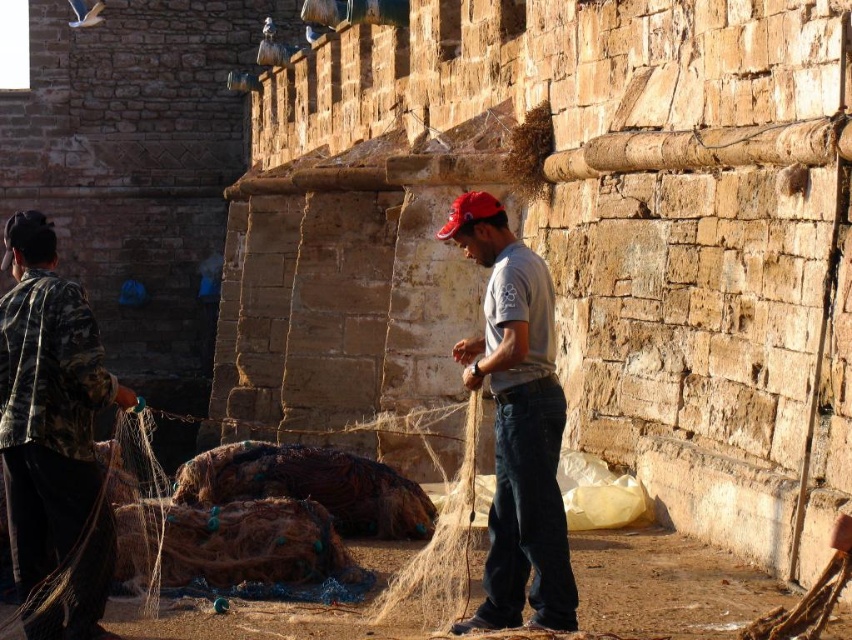
Question: Which is farther from the gray cotton shirt at center?

Choices:
 (A) camo fabric jacket at left
 (B) red fabric baseball cap at center

Answer: (A)

Question: Which object appears closest to the camera in this image?

Choices:
 (A) gray cotton shirt at center
 (B) black fabric baseball cap at upper left

Answer: (A)

Question: Can you confirm if camo fabric jacket at left is positioned below red fabric baseball cap at center?

Choices:
 (A) no
 (B) yes

Answer: (B)

Question: Observing the image, what is the correct spatial positioning of camo fabric jacket at left in reference to red fabric baseball cap at center?

Choices:
 (A) right
 (B) left

Answer: (B)

Question: Estimate the real-world distances between objects in this image. Which object is farther from the gray cotton shirt at center?

Choices:
 (A) black fabric baseball cap at upper left
 (B) camo fabric jacket at left

Answer: (A)

Question: Can you confirm if gray cotton shirt at center is thinner than black fabric baseball cap at upper left?

Choices:
 (A) no
 (B) yes

Answer: (B)